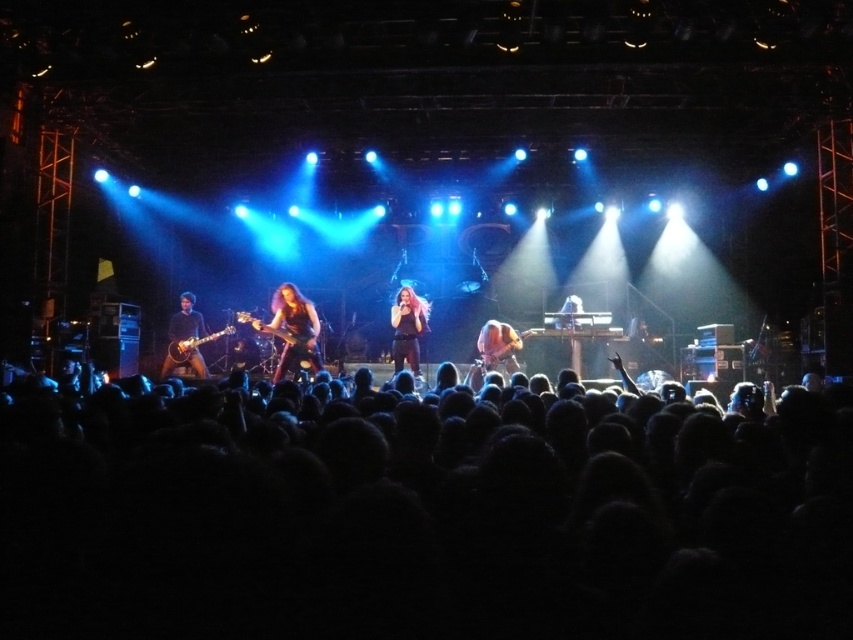
Between point (376, 509) and point (216, 332), which one is positioned behind?

The point (216, 332) is more distant.

Measure the distance between black hair at lower center and camera.

black hair at lower center and camera are 5.42 feet apart.

Image resolution: width=853 pixels, height=640 pixels. Find the location of `black hair at lower center`. black hair at lower center is located at coordinates (421, 513).

In the scene shown: Between shiny black microphone at center and glossy black guitar at left, which one is positioned higher?

shiny black microphone at center is higher up.

How far apart are shiny black microphone at center and glossy black guitar at left?

2.36 meters

Is point (404, 300) positioned after point (169, 355)?

No, (404, 300) is closer to viewer.

Locate an element on the screen. shiny black microphone at center is located at coordinates (407, 328).

Which is below, matte black guitar at left or shiny brown guitar at center?

Positioned lower is shiny brown guitar at center.

Which is in front, point (166, 371) or point (509, 336)?

Point (509, 336) is more forward.

Identify the location of matte black guitar at left. (184, 339).